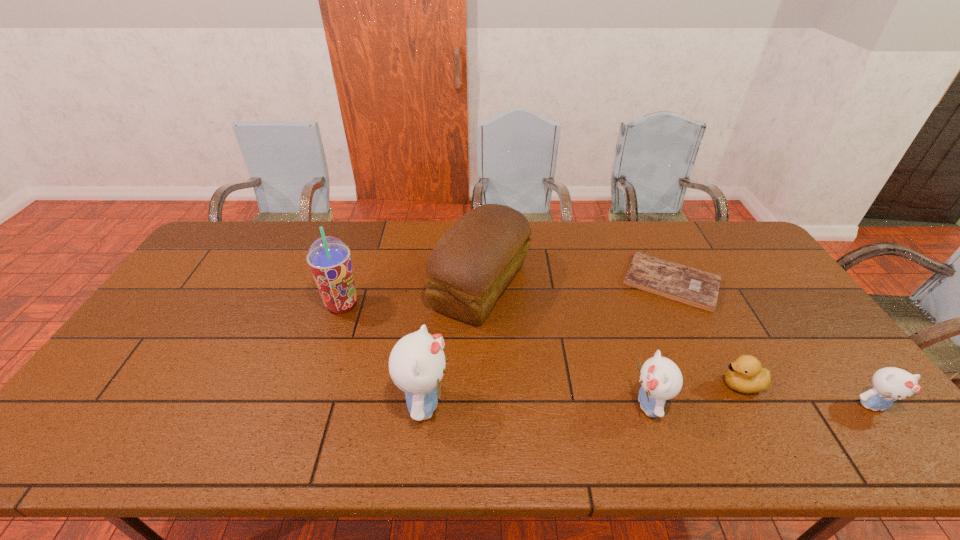
This screenshot has width=960, height=540. In order to click on vacant spot to place a kitten on the left in this screenshot , I will do `click(202, 403)`.